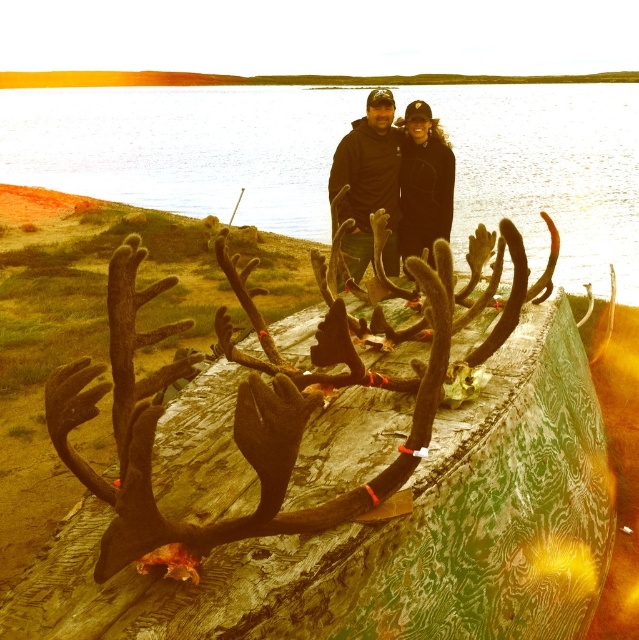
Who is taller, greenish water at upper center or black fleece jacket at center?

With more height is greenish water at upper center.

Which is more to the right, greenish water at upper center or black fleece jacket at center?

black fleece jacket at center

Between point (91, 145) and point (413, 132), which one is positioned in front?

Point (413, 132) is more forward.

You are a GUI agent. You are given a task and a screenshot of the screen. Output one action in this format:
    pyautogui.click(x=<x>, y=<y>)
    Task: Click on the greenish water at upper center
    This screenshot has width=639, height=640.
    Given the screenshot: What is the action you would take?
    pyautogui.click(x=183, y=148)

Image resolution: width=639 pixels, height=640 pixels. What do you see at coordinates (387, 180) in the screenshot?
I see `matte black jacket at center` at bounding box center [387, 180].

Can you confirm if matte black jacket at center is shorter than black fleece jacket at center?

In fact, matte black jacket at center may be taller than black fleece jacket at center.

Is point (390, 115) positioned before point (440, 218)?

Yes, point (390, 115) is closer to viewer.

At what (x,y) coordinates should I click in order to perform the action: click on matte black jacket at center. Please return your answer as a coordinate pair (x, y). Looking at the image, I should click on (387, 180).

Where is `greenish water at upper center`? Image resolution: width=639 pixels, height=640 pixels. greenish water at upper center is located at coordinates point(183,148).

Is greenish water at upper center to the right of matte black jacket at center from the viewer's perspective?

In fact, greenish water at upper center is to the left of matte black jacket at center.

The width and height of the screenshot is (639, 640). Describe the element at coordinates (183, 148) in the screenshot. I see `greenish water at upper center` at that location.

I want to click on greenish water at upper center, so click(x=183, y=148).